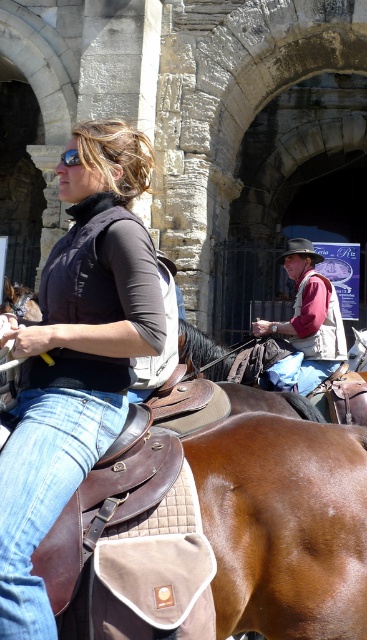
Question: Is rustic brown vest at center in front of brown felt cowboy hat at center?

Choices:
 (A) no
 (B) yes

Answer: (B)

Question: Which of the following is the closest to the observer?

Choices:
 (A) (71, 161)
 (B) (70, 486)

Answer: (B)

Question: Based on their relative distances, which object is nearer to the rustic brown vest at center?

Choices:
 (A) black matte goggles at upper left
 (B) matte black vest at upper left
 (C) brown felt cowboy hat at center

Answer: (C)

Question: Estimate the real-world distances between objects in this image. Which object is closer to the black matte goggles at upper left?

Choices:
 (A) rustic brown vest at center
 (B) brown felt cowboy hat at center

Answer: (A)

Question: Can you confirm if brown felt cowboy hat at center is thinner than black matte goggles at upper left?

Choices:
 (A) no
 (B) yes

Answer: (B)

Question: Is rustic brown vest at center closer to the viewer compared to brown felt cowboy hat at center?

Choices:
 (A) yes
 (B) no

Answer: (A)